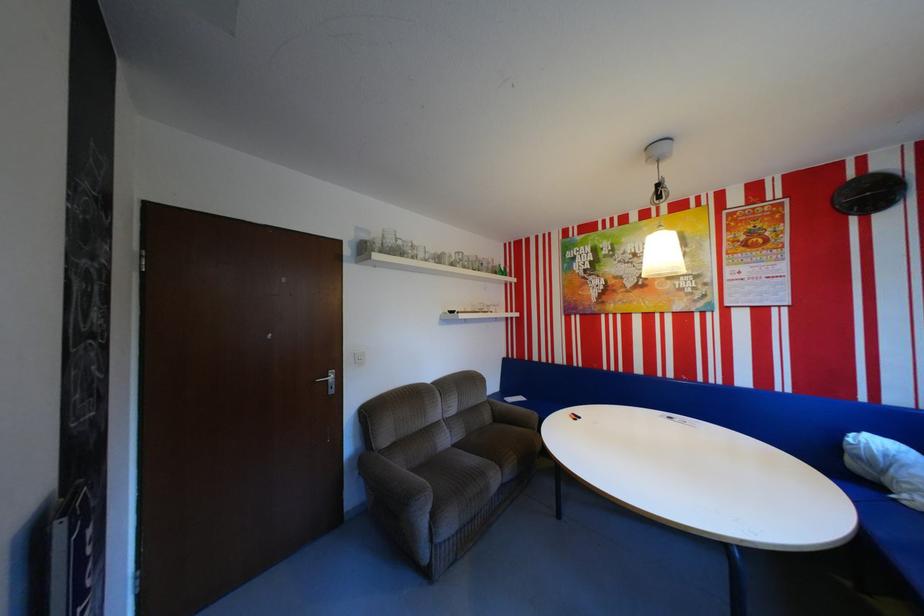
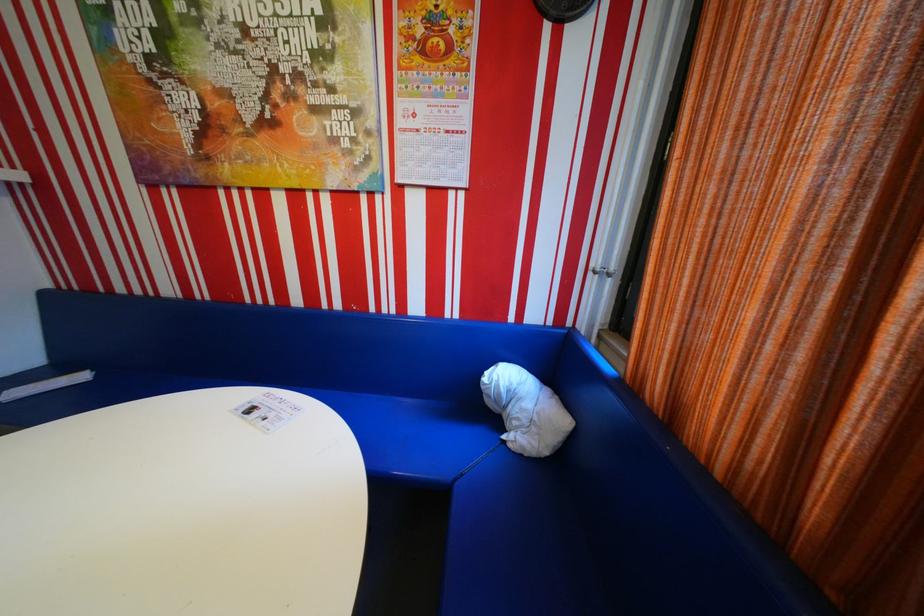
The point at (x=870, y=456) is marked in the first image. Where is the corresponding point in the second image?

(502, 395)